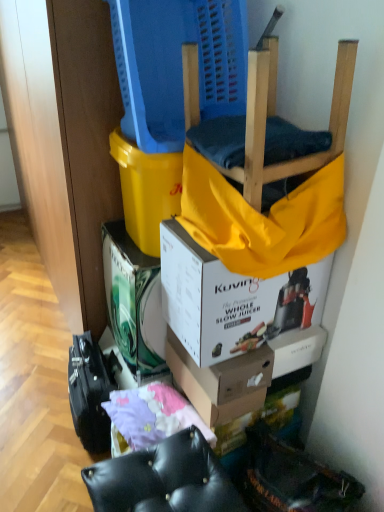
Question: Visually, is white cardboard box at upper center, placed as the 1th box when sorted from front to back, positioned to the left or to the right of black leather ottoman at lower center?

Choices:
 (A) right
 (B) left

Answer: (A)

Question: In terms of size, does white cardboard box at upper center, the 3th box viewed from the back, appear bigger or smaller than black leather ottoman at lower center?

Choices:
 (A) small
 (B) big

Answer: (A)

Question: Which is farther from the purple fabric at lower center?

Choices:
 (A) white cardboard box at center, the first box from the back
 (B) white cardboard box at upper center, the 3th box viewed from the back
 (C) wooden chair at upper center
 (D) black leather ottoman at lower center
 (E) yellow fabric at upper center

Answer: (C)

Question: Estimate the real-world distances between objects in this image. Which object is closer to the yellow fabric at upper center?

Choices:
 (A) white cardboard box at upper center, placed as the 1th box when sorted from front to back
 (B) purple fabric at lower center
 (C) black leather ottoman at lower center
 (D) wooden chair at upper center
 (E) white cardboard box at center, placed as the second box when sorted from back to front

Answer: (D)